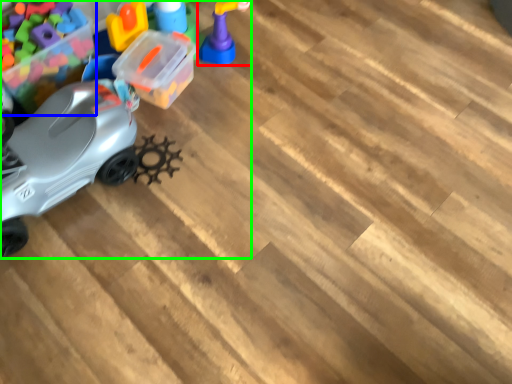
Question: Which is nearer to the toy (highlighted by a red box)? toy (highlighted by a blue box) or toy (highlighted by a green box).

Choices:
 (A) toy
 (B) toy

Answer: (B)